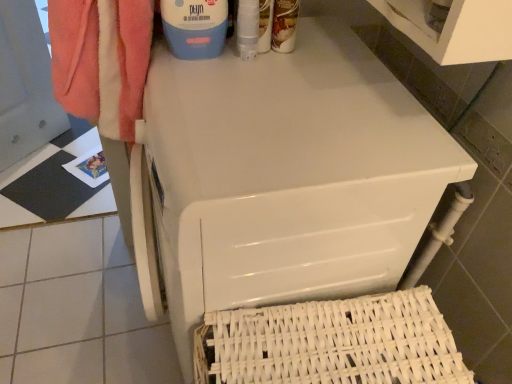
Find the location of a particular element. free spot to the left of matte brown bottle at upper center, the 1th cleaning product positioned from the right is located at coordinates (195, 54).